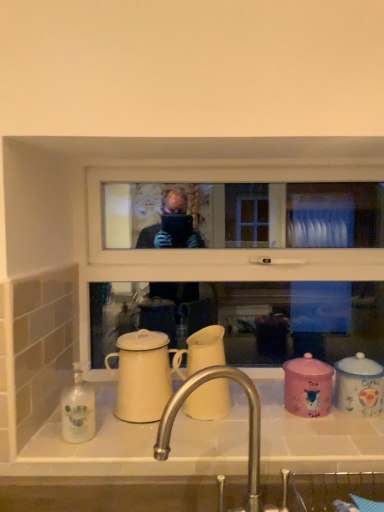
Where is `free space in front of pink ceramic jar at lower right, the second coffee cup viewed from the right`? free space in front of pink ceramic jar at lower right, the second coffee cup viewed from the right is located at coordinates (328, 438).